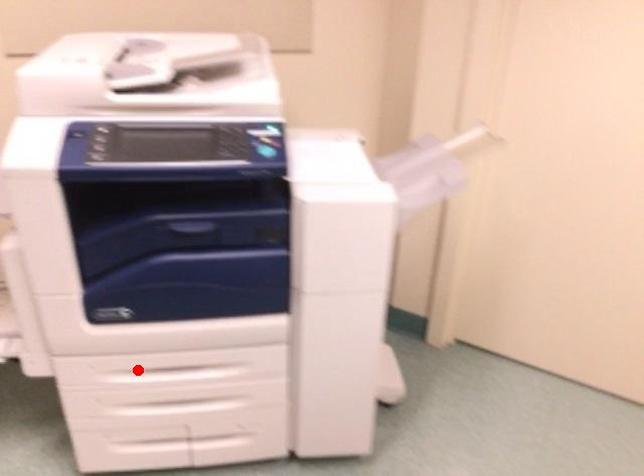
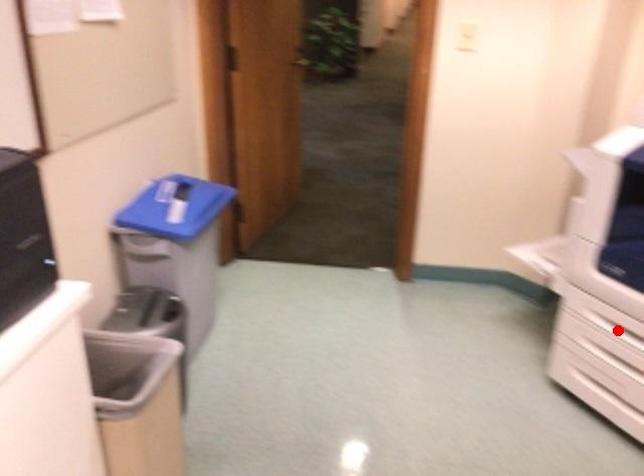
Based on the photo, I am providing you with two images of the same scene from different viewpoints. A red point is marked on the first image and another point is marked on the second image. Is the red point in image1 aligned with the point shown in image2?

Yes